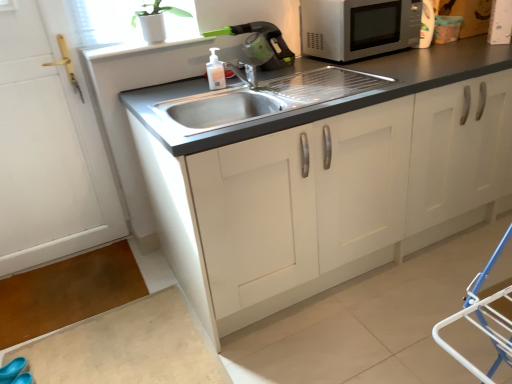
Question: Would you say blue rubber shoe at lower left is to the left or to the right of green plastic kettle at upper center, the first appliance viewed from the left, in the picture?

Choices:
 (A) right
 (B) left

Answer: (B)

Question: Considering the positions of blue rubber shoe at lower left and green plastic kettle at upper center, the first appliance viewed from the left, in the image, is blue rubber shoe at lower left bigger or smaller than green plastic kettle at upper center, the first appliance viewed from the left,?

Choices:
 (A) big
 (B) small

Answer: (B)

Question: Estimate the real-world distances between objects in this image. Which object is closer to the white matte door at left?

Choices:
 (A) white matte cabinet at center
 (B) white plastic container at upper right, acting as the second appliance starting from the left
 (C) green plastic kettle at upper center, the first appliance viewed from the left
 (D) translucent plastic soap dispenser at sink
 (E) blue rubber shoe at lower left

Answer: (D)

Question: Based on their relative distances, which object is farther from the green plastic kettle at upper center, the first appliance viewed from the left?

Choices:
 (A) white matte door at left
 (B) blue rubber shoe at lower left
 (C) white matte cabinet at center
 (D) stainless steel sink at center
 (E) white plastic container at upper right, acting as the second appliance starting from the left

Answer: (B)